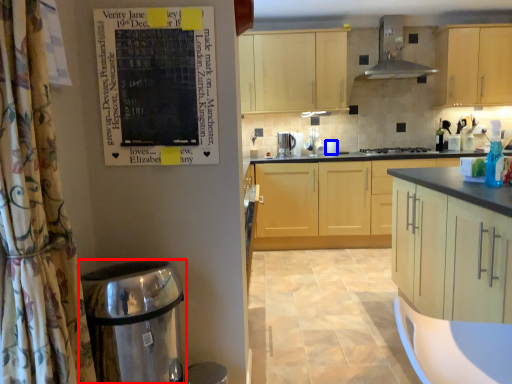
Question: Which object appears closest to the camera in this image, water heater (highlighted by a red box) or appliance (highlighted by a blue box)?

Choices:
 (A) water heater
 (B) appliance

Answer: (A)